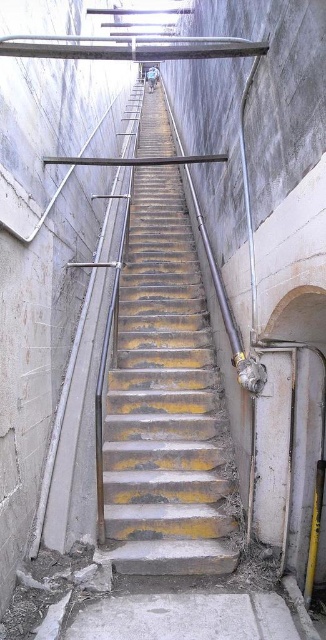
You are standing at the bottom of the staircase and want to climb up. Which object is closer to you as you start ascending the stairs? The yellow painted metal stairs at center or the gray concrete floor at bottom?

The gray concrete floor at bottom is closer to you as you start ascending the stairs because the yellow painted metal stairs at center are further away from the viewer.

You are standing at the base of the staircase and want to climb up. Where exactly are the yellow painted metal stairs at center located in this scene?

The yellow painted metal stairs at center are located at point (165, 403).